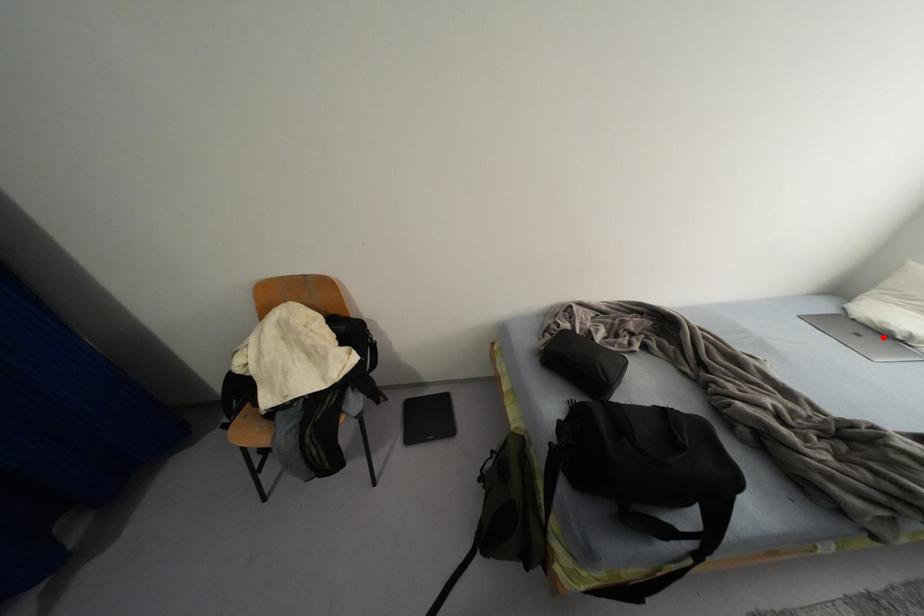
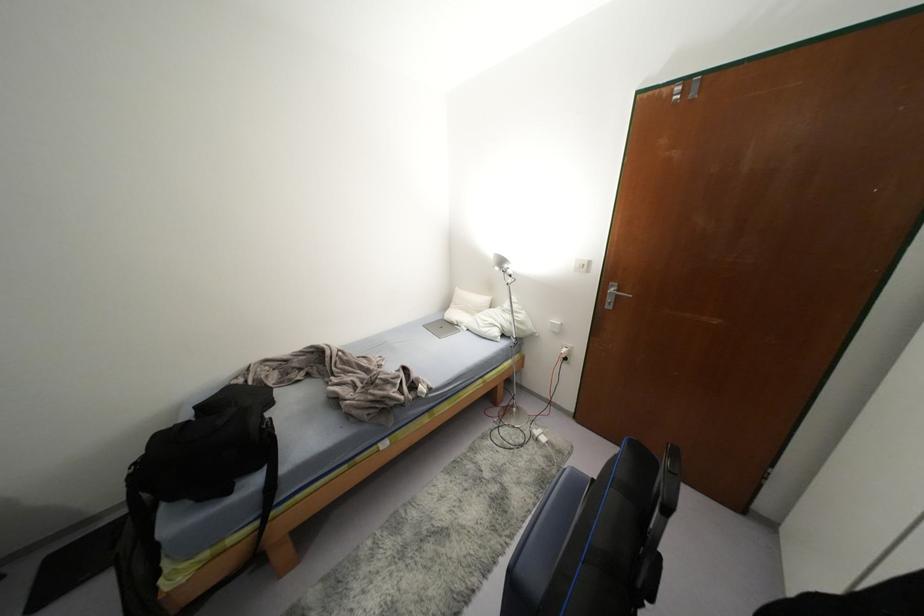
The point at the highlighted location is marked in the first image. Where is the corresponding point in the second image?

(452, 325)